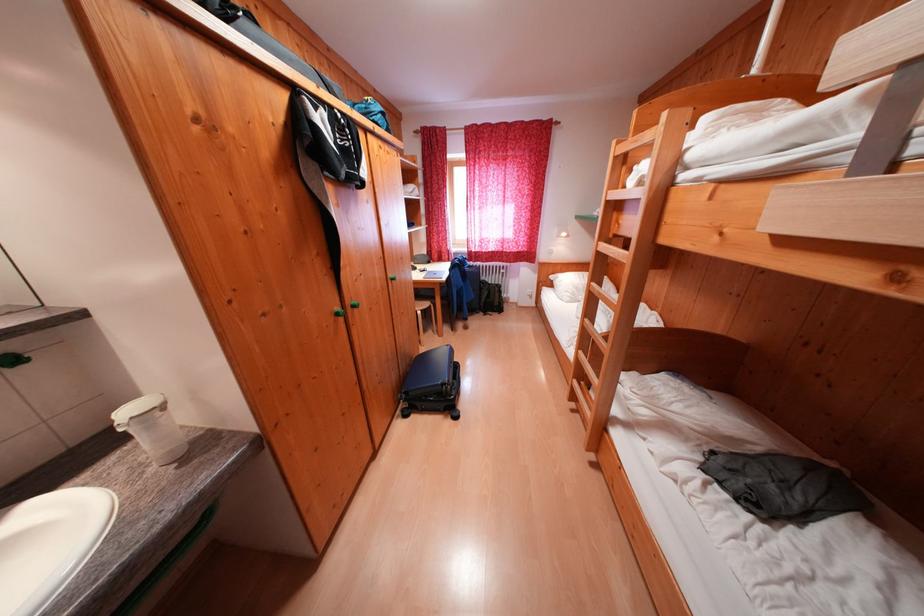
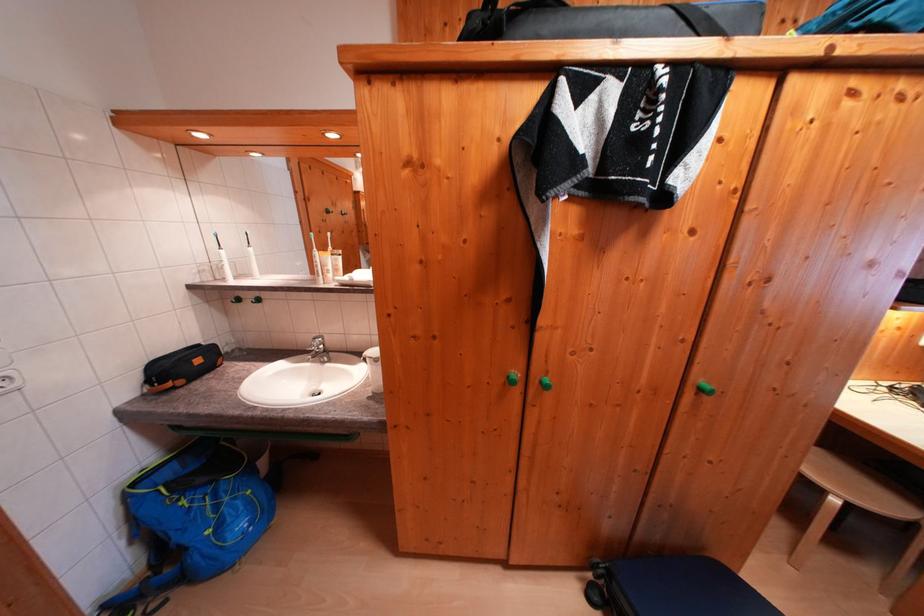
The point at (x=414, y=419) is marked in the first image. Where is the corresponding point in the second image?

(598, 602)